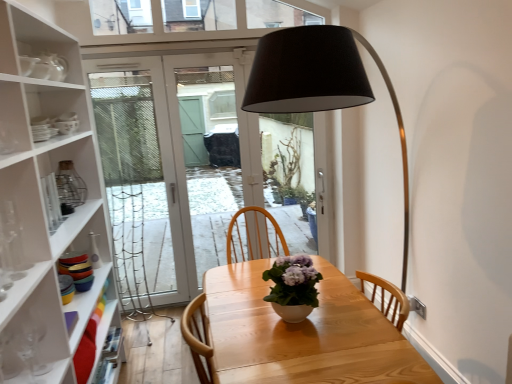
Question: Is matte white door at center to the left or to the right of light wood table at center in the image?

Choices:
 (A) right
 (B) left

Answer: (B)

Question: Is matte white door at center taller or shorter than light wood table at center?

Choices:
 (A) tall
 (B) short

Answer: (A)

Question: Which of these objects is positioned closest to the clear glass vase at left?

Choices:
 (A) matte white door at center
 (B) light wood table at center
 (C) white glossy vase at center

Answer: (B)

Question: Estimate the real-world distances between objects in this image. Which object is farther from the light wood table at center?

Choices:
 (A) clear glass vase at left
 (B) white glossy vase at center
 (C) matte white door at center

Answer: (C)